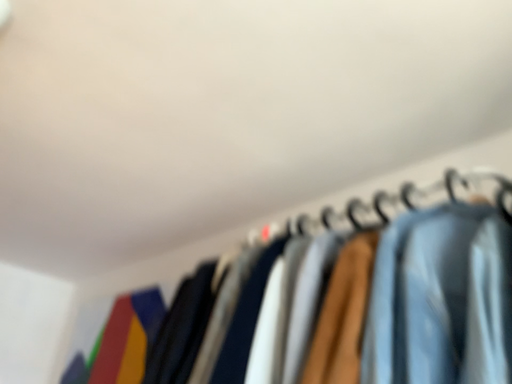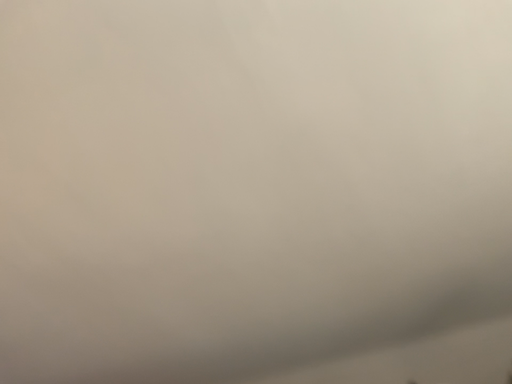
Question: How did the camera likely rotate when shooting the video?

Choices:
 (A) rotated right
 (B) rotated left

Answer: (A)